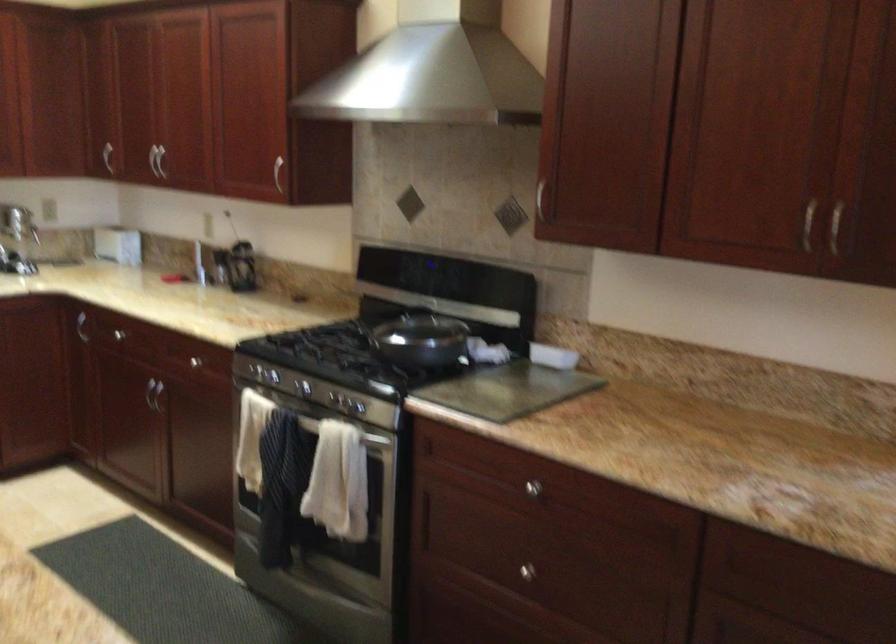
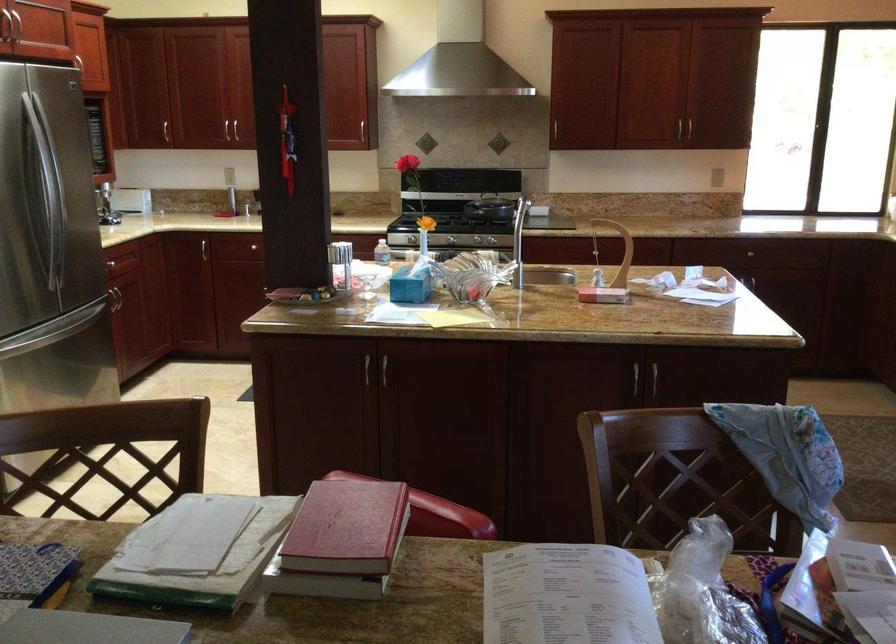
Where in the second image is the point corresponding to point 158,165 from the first image?

(165, 131)